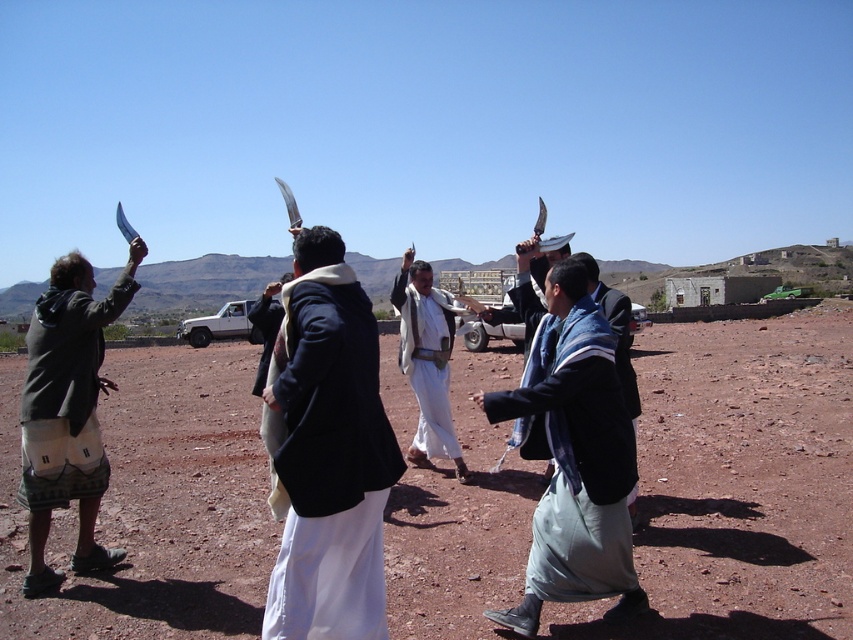
Can you confirm if green woven cloth at left is taller than white woolen robe at center?

No, green woven cloth at left is not taller than white woolen robe at center.

Which is more to the left, green woven cloth at left or white woolen robe at center?

From the viewer's perspective, white woolen robe at center appears more on the left side.

Which is behind, point (90, 333) or point (270, 451)?

The point (90, 333) is behind.

Where is `green woven cloth at left`? The image size is (853, 640). green woven cloth at left is located at coordinates (65, 390).

How far apart are green woven cloth at left and white matte robe at center?

The distance of green woven cloth at left from white matte robe at center is 9.78 feet.

Is green woven cloth at left positioned before white matte robe at center?

Yes, it is in front of white matte robe at center.

The image size is (853, 640). Find the location of `green woven cloth at left`. green woven cloth at left is located at coordinates (65, 390).

Is light blue fabric at center smaller than white matte robe at center?

Correct, light blue fabric at center occupies less space than white matte robe at center.

Who is positioned more to the left, light blue fabric at center or white matte robe at center?

From the viewer's perspective, white matte robe at center appears more on the left side.

Is point (598, 515) in front of point (416, 340)?

Yes, it is.

Where is `light blue fabric at center`? light blue fabric at center is located at coordinates (573, 458).